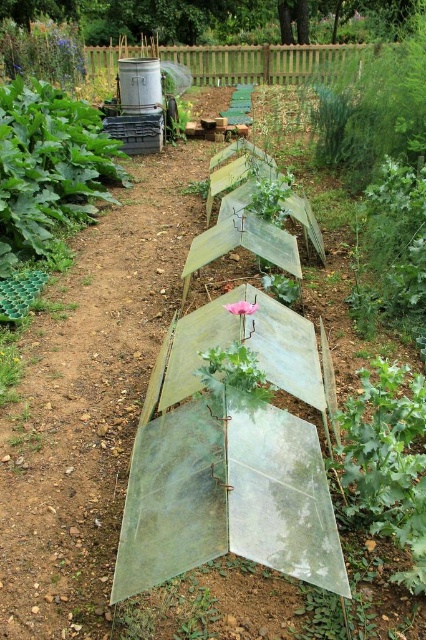
Question: Can you confirm if green leafy plant at upper left is thinner than green leafy plant at center?

Choices:
 (A) no
 (B) yes

Answer: (A)

Question: Is green leafy plant at upper left wider than green leafy plant at center?

Choices:
 (A) no
 (B) yes

Answer: (B)

Question: Estimate the real-world distances between objects in this image. Which object is farther from the green leafy plant at upper left?

Choices:
 (A) transparent plastic sheet at center
 (B) green leafy plant at center

Answer: (B)

Question: From the image, what is the correct spatial relationship of green leafy plant at upper left in relation to green leafy plant at center?

Choices:
 (A) right
 (B) left

Answer: (B)

Question: Which of the following is the closest to the observer?

Choices:
 (A) (416, 557)
 (B) (51, 102)

Answer: (A)

Question: Which of the following is the closest to the observer?

Choices:
 (A) (344, 420)
 (B) (37, 131)

Answer: (A)